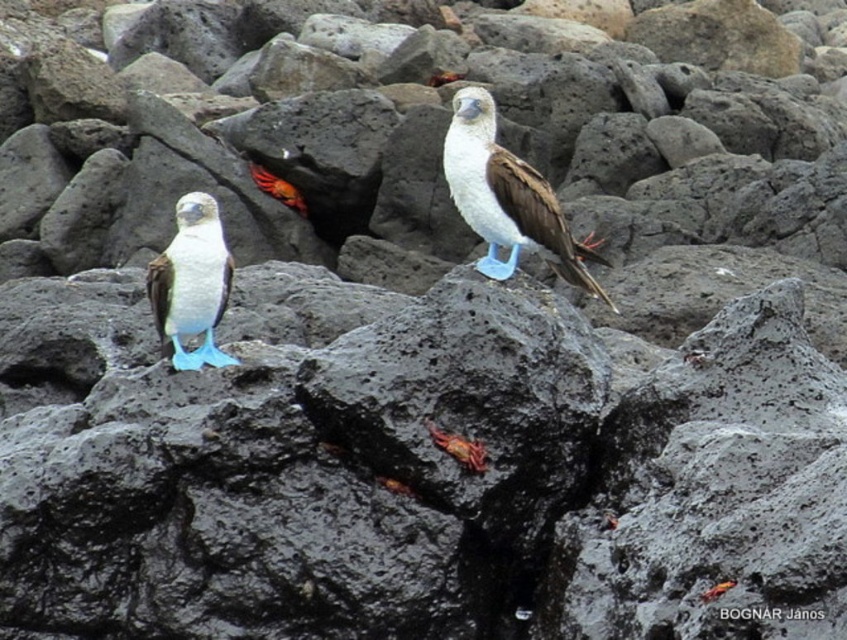
Is smooth orange crab at center further to camera compared to shiny orange crab at center?

No, smooth orange crab at center is closer to the viewer.

Does smooth orange crab at center appear on the left side of shiny orange crab at center?

Incorrect, smooth orange crab at center is not on the left side of shiny orange crab at center.

The image size is (847, 640). What do you see at coordinates (458, 448) in the screenshot? I see `smooth orange crab at center` at bounding box center [458, 448].

You are a GUI agent. You are given a task and a screenshot of the screen. Output one action in this format:
    pyautogui.click(x=<x>, y=<y>)
    Task: Click on the smooth orange crab at center
    The width and height of the screenshot is (847, 640).
    Given the screenshot: What is the action you would take?
    pyautogui.click(x=458, y=448)

Who is taller, white matte/blue feet at center or smooth orange crab at center?

white matte/blue feet at center is taller.

Which is behind, point (461, 164) or point (475, 458)?

The point (461, 164) is more distant.

Identify the location of white matte/blue feet at center. (507, 198).

Which is below, matte white bird at center or smooth orange crab at center?

smooth orange crab at center is below.

Describe the element at coordinates (191, 284) in the screenshot. I see `matte white bird at center` at that location.

Where is `matte white bird at center`? matte white bird at center is located at coordinates (191, 284).